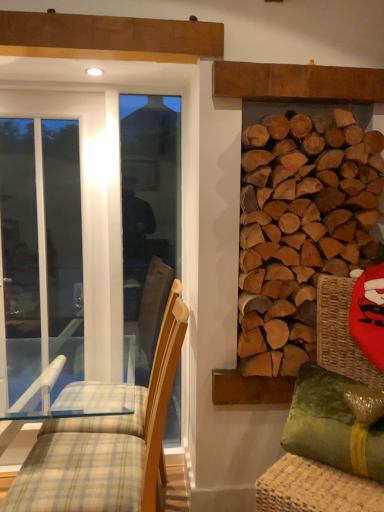
Question: From a real-world perspective, is natural wood logs at right physically above white glass screen door at left?

Choices:
 (A) yes
 (B) no

Answer: (A)

Question: Can you confirm if natural wood logs at right is taller than white glass screen door at left?

Choices:
 (A) yes
 (B) no

Answer: (B)

Question: Does natural wood logs at right have a lesser height compared to white glass screen door at left?

Choices:
 (A) no
 (B) yes

Answer: (B)

Question: Are natural wood logs at right and white glass screen door at left located far from each other?

Choices:
 (A) no
 (B) yes

Answer: (B)

Question: Can you confirm if natural wood logs at right is bigger than white glass screen door at left?

Choices:
 (A) yes
 (B) no

Answer: (A)

Question: Does point (102, 442) appear closer or farther from the camera than point (329, 217)?

Choices:
 (A) farther
 (B) closer

Answer: (B)

Question: From a real-world perspective, relative to natural wood logs at right, is light brown wood chair at left vertically above or below?

Choices:
 (A) above
 (B) below

Answer: (B)

Question: Do you think light brown wood chair at left is within natural wood logs at right, or outside of it?

Choices:
 (A) outside
 (B) inside

Answer: (A)

Question: Based on their sizes in the image, would you say light brown wood chair at left is bigger or smaller than natural wood logs at right?

Choices:
 (A) small
 (B) big

Answer: (B)

Question: Is green velvet pillow at lower right spatially inside white glass screen door at left, or outside of it?

Choices:
 (A) inside
 (B) outside

Answer: (B)

Question: Is point (301, 417) closer or farther from the camera than point (9, 322)?

Choices:
 (A) farther
 (B) closer

Answer: (B)

Question: From a real-world perspective, is green velvet pillow at lower right physically located above or below white glass screen door at left?

Choices:
 (A) below
 (B) above

Answer: (A)

Question: From the image's perspective, is green velvet pillow at lower right located above or below white glass screen door at left?

Choices:
 (A) above
 (B) below

Answer: (B)

Question: In terms of height, does white glass screen door at left look taller or shorter compared to green fabric swivel chair at right?

Choices:
 (A) short
 (B) tall

Answer: (B)

Question: Is white glass screen door at left to the left or to the right of green fabric swivel chair at right in the image?

Choices:
 (A) left
 (B) right

Answer: (A)